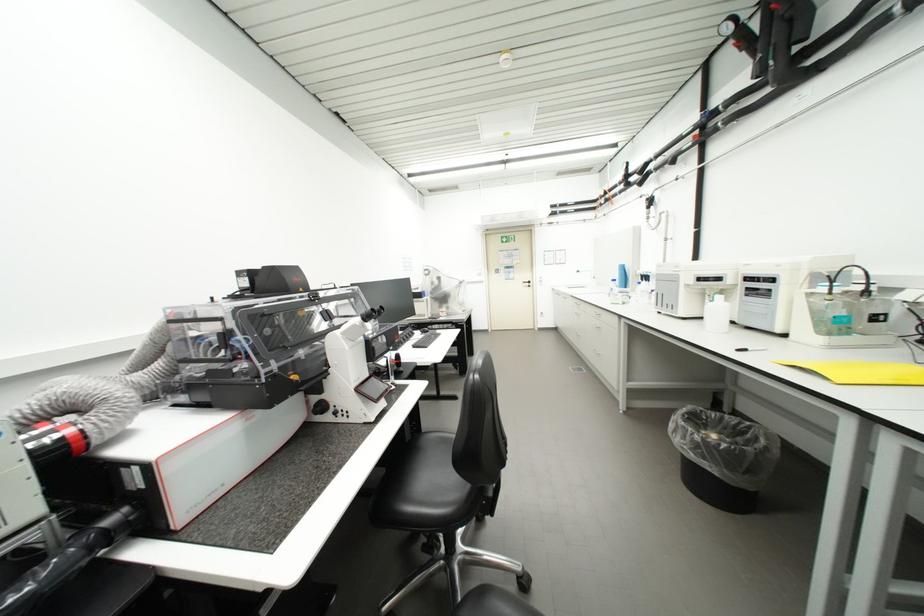
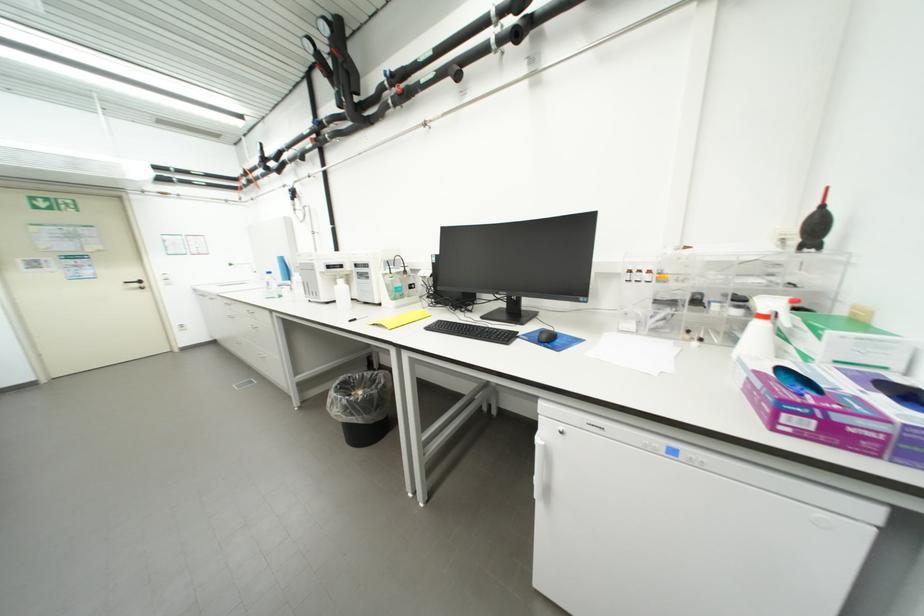
The point at (535, 285) is marked in the first image. Where is the corresponding point in the second image?

(144, 286)